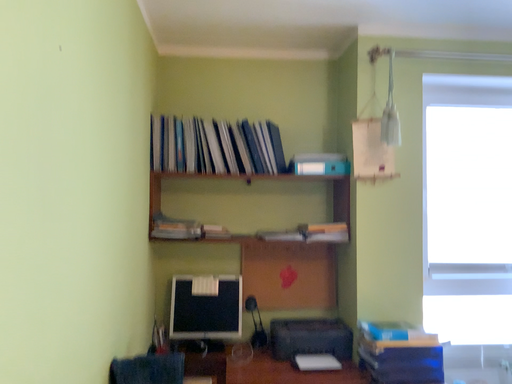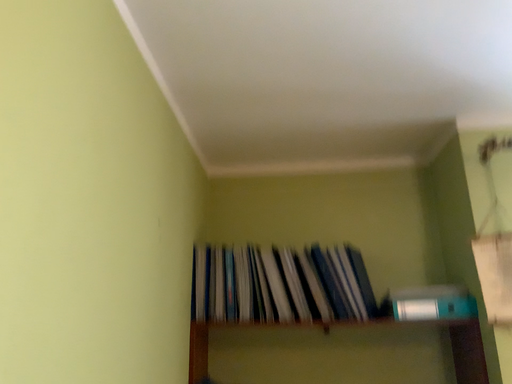
Question: Which way did the camera rotate in the video?

Choices:
 (A) rotated right
 (B) rotated left

Answer: (B)